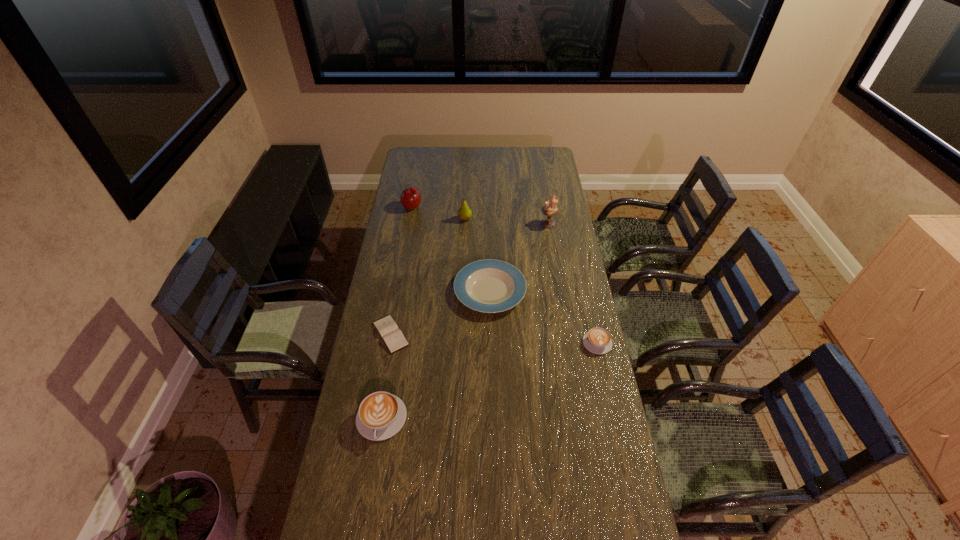
The height and width of the screenshot is (540, 960). I want to click on object that is the sixth nearest to the rightmost object, so click(410, 198).

You are a GUI agent. You are given a task and a screenshot of the screen. Output one action in this format:
    pyautogui.click(x=<x>, y=<y>)
    Task: Click on the sixth closest object relative to the plate
    The image size is (960, 540).
    Given the screenshot: What is the action you would take?
    pyautogui.click(x=410, y=198)

You are a GUI agent. You are given a task and a screenshot of the screen. Output one action in this format:
    pyautogui.click(x=<x>, y=<y>)
    Task: Click on the free space that satisfies the following two spatial constraints: 1. on the back side of the candle holder; 2. on the right side of the plate
    Image resolution: width=960 pixels, height=540 pixels.
    Given the screenshot: What is the action you would take?
    pyautogui.click(x=489, y=224)